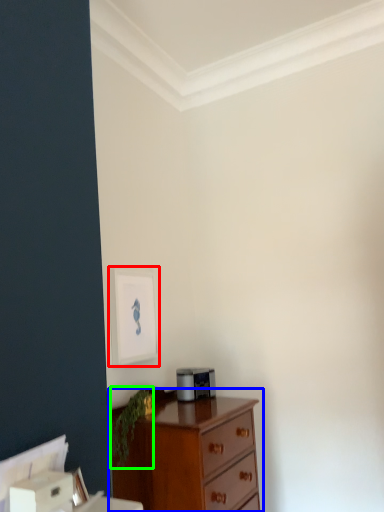
Question: Based on their relative distances, which object is farther from picture frame (highlighted by a red box)? Choose from chest of drawers (highlighted by a blue box) and plant (highlighted by a green box).

Choices:
 (A) chest of drawers
 (B) plant

Answer: (A)